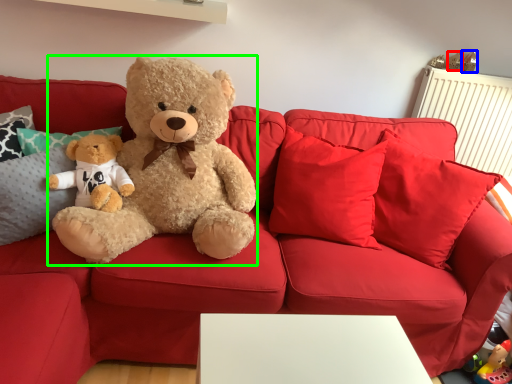
Question: Which object is positioned closest to toy (highlighted by a red box)? Select from toy (highlighted by a blue box) and teddy bear (highlighted by a green box).

Choices:
 (A) toy
 (B) teddy bear

Answer: (A)